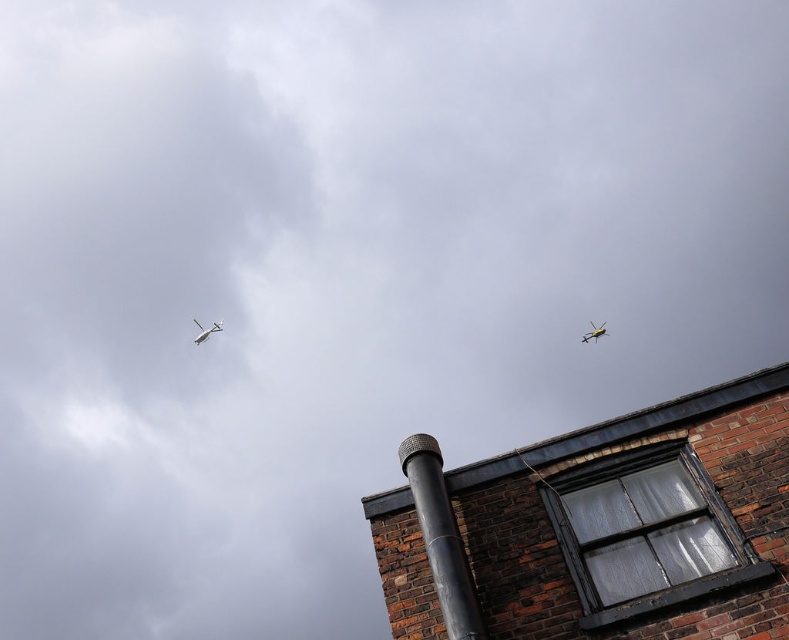
Between white glossy airplane at upper left and metallic yellow airplane at upper right, which one is positioned lower?

metallic yellow airplane at upper right is lower down.

In the scene shown: Who is positioned more to the right, white glossy airplane at upper left or metallic yellow airplane at upper right?

From the viewer's perspective, metallic yellow airplane at upper right appears more on the right side.

Which is in front, point (197, 340) or point (604, 330)?

Positioned in front is point (604, 330).

At what (x,y) coordinates should I click in order to perform the action: click on white glossy airplane at upper left. Please return your answer as a coordinate pair (x, y). Looking at the image, I should click on (206, 330).

Is the position of smooth brick chimney at upper right less distant than that of white glossy airplane at upper left?

Yes, it is in front of white glossy airplane at upper left.

Between smooth brick chimney at upper right and white glossy airplane at upper left, which one is positioned higher?

white glossy airplane at upper left

Locate an element on the screen. Image resolution: width=789 pixels, height=640 pixels. smooth brick chimney at upper right is located at coordinates (600, 528).

Is smooth brick chimney at upper right behind metallic yellow airplane at upper right?

No, smooth brick chimney at upper right is closer to the viewer.

Which is above, smooth brick chimney at upper right or metallic yellow airplane at upper right?

metallic yellow airplane at upper right is above.

Find the location of a particular element. smooth brick chimney at upper right is located at coordinates (600, 528).